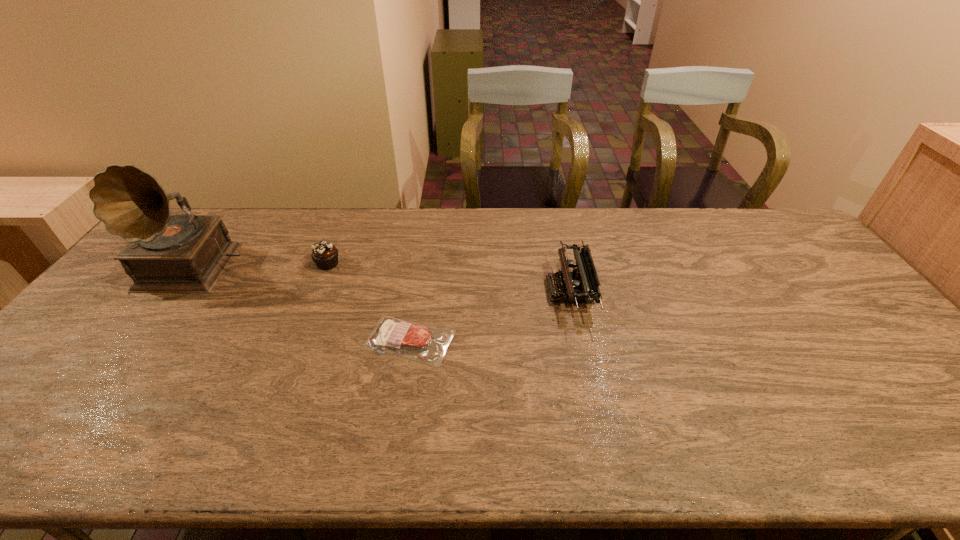
This screenshot has width=960, height=540. Find the location of `vacant region between the tallest object and the shortest object`. vacant region between the tallest object and the shortest object is located at coordinates (303, 303).

Locate an element on the screen. The height and width of the screenshot is (540, 960). vacant space in between the rightmost object and the record player is located at coordinates (384, 278).

Locate an element on the screen. The image size is (960, 540). empty space between the leftmost object and the second shortest object is located at coordinates (263, 265).

The image size is (960, 540). Find the location of `free space between the typewriter and the shortest object`. free space between the typewriter and the shortest object is located at coordinates (490, 315).

Where is `free space between the shortest object and the second tallest object`? Image resolution: width=960 pixels, height=540 pixels. free space between the shortest object and the second tallest object is located at coordinates (490, 315).

What are the coordinates of `free space between the second object from right to left and the leftmost object` in the screenshot? It's located at (303, 303).

Find the location of `free point between the cupcake and the third object from left to right`. free point between the cupcake and the third object from left to right is located at coordinates (369, 302).

The height and width of the screenshot is (540, 960). I want to click on vacant region between the cupcake and the shortest object, so click(369, 302).

Identify the location of free space between the cupcake and the shortest object. (369, 302).

Locate an element on the screen. This screenshot has width=960, height=540. free point between the typewriter and the cupcake is located at coordinates (448, 277).